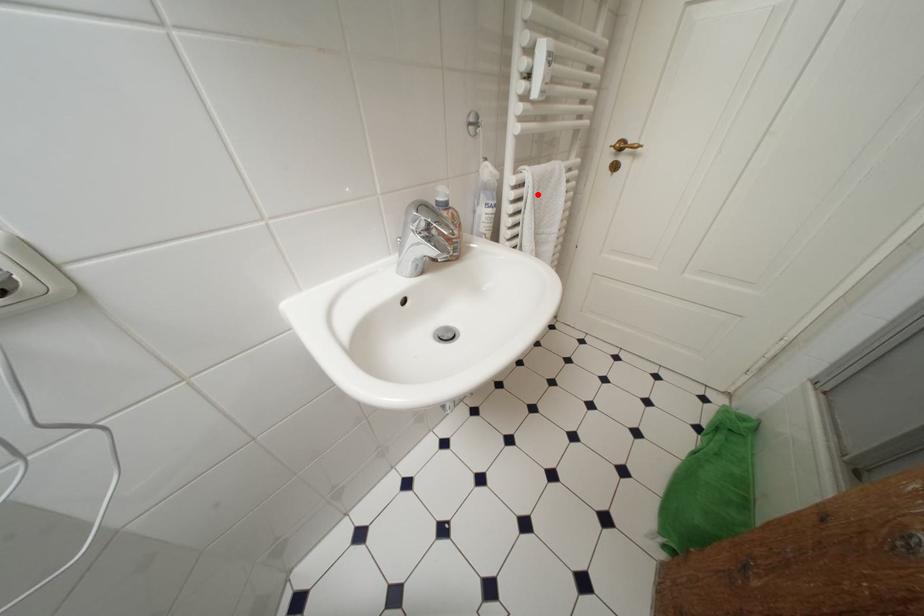
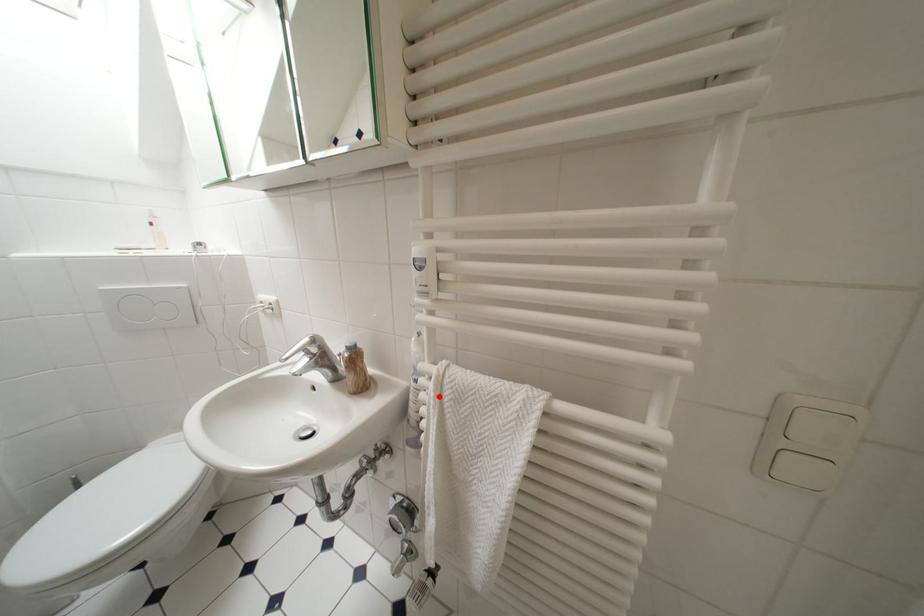
I am providing you with two images of the same scene from different viewpoints. A red point is marked on the first image and another point is marked on the second image. Is the red point in image1 aligned with the point shown in image2?

Yes